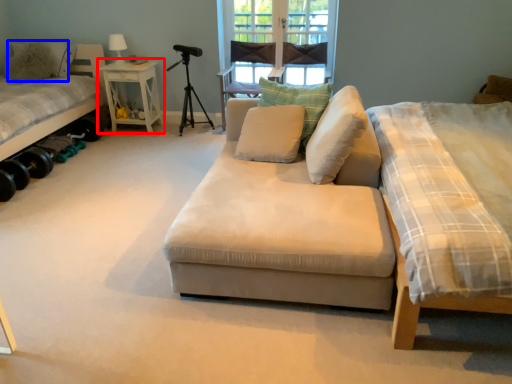
Question: Which of the following is the farthest to the observer, nightstand (highlighted by a red box) or pillow (highlighted by a blue box)?

Choices:
 (A) nightstand
 (B) pillow

Answer: (A)